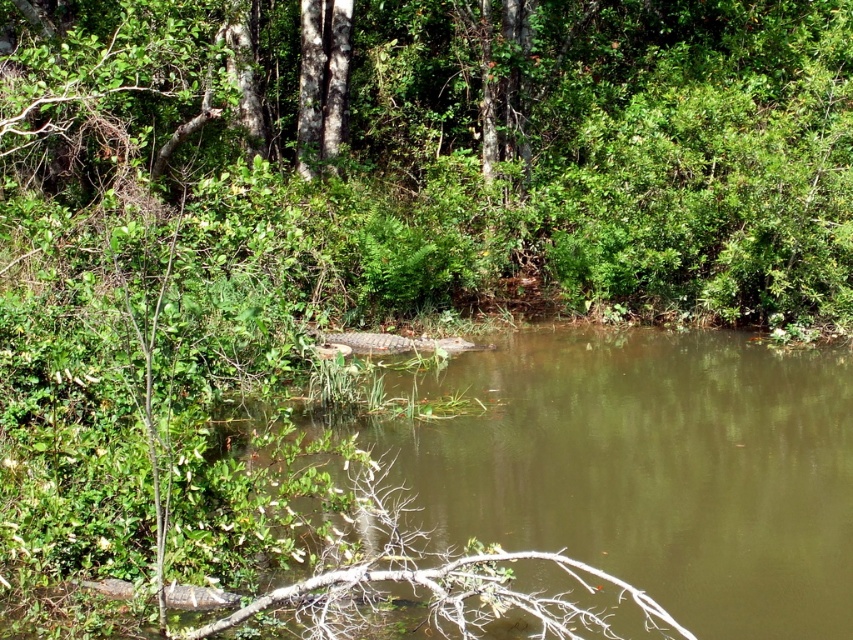
Is green leafy tree at center wider than brown muddy water at center?

Yes, green leafy tree at center is wider than brown muddy water at center.

Which is behind, point (671, 108) or point (782, 515)?

The point (671, 108) is behind.

Is point (515, 186) behind point (576, 456)?

Yes.

The image size is (853, 640). Find the location of `green leafy tree at center`. green leafy tree at center is located at coordinates (469, 141).